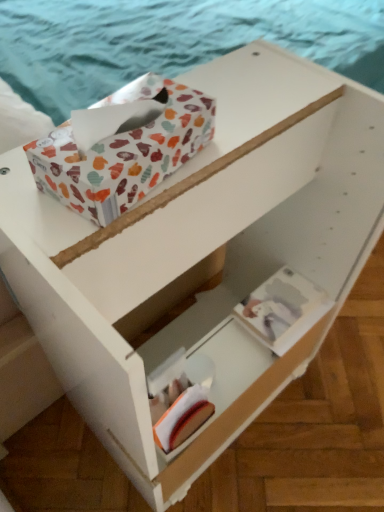
In the scene shown: Measure the distance between patterned paper tissue box at upper left and camera.

The distance of patterned paper tissue box at upper left from camera is 18.24 inches.

This screenshot has width=384, height=512. Describe the element at coordinates (124, 151) in the screenshot. I see `patterned paper tissue box at upper left` at that location.

Where is `patterned paper tissue box at upper left`? The height and width of the screenshot is (512, 384). patterned paper tissue box at upper left is located at coordinates (124, 151).

This screenshot has height=512, width=384. Identify the location of patterned paper tissue box at upper left. (124, 151).